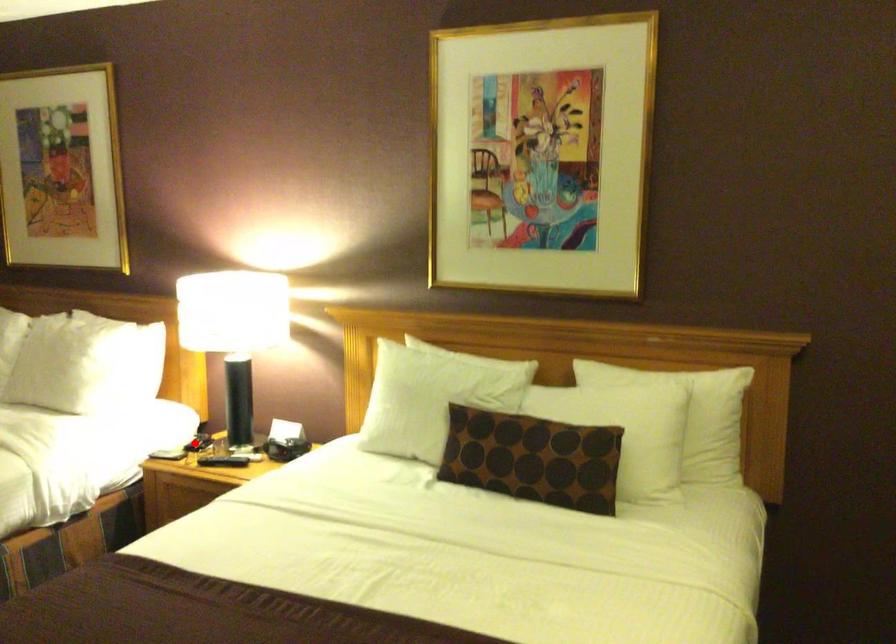
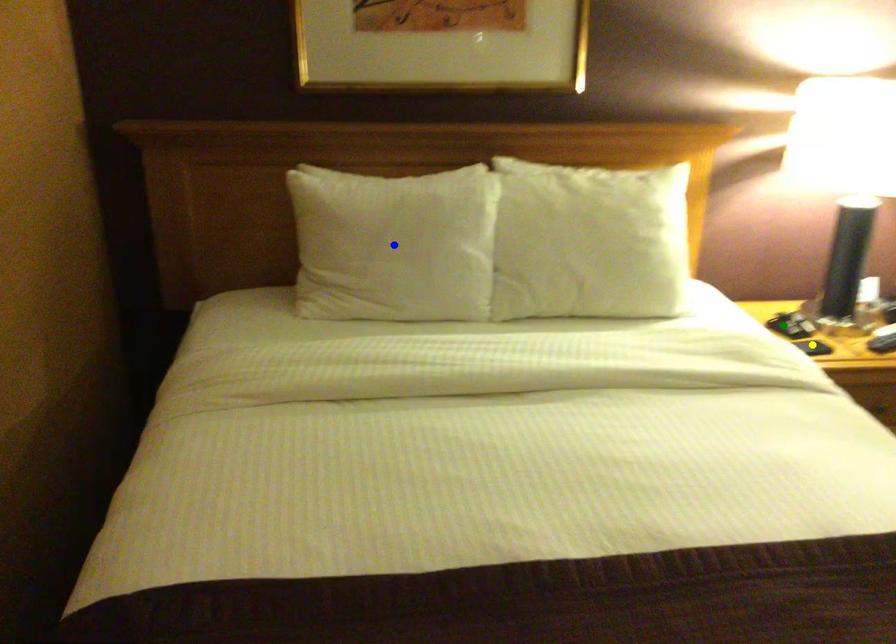
Question: I am providing you with two images of the same scene from different viewpoints. A red point is marked on the first image. You are given multiple points on the second image. In image 2, which mark is for the same physical point as the one in image 1?

Choices:
 (A) green point
 (B) yellow point
 (C) blue point

Answer: (A)